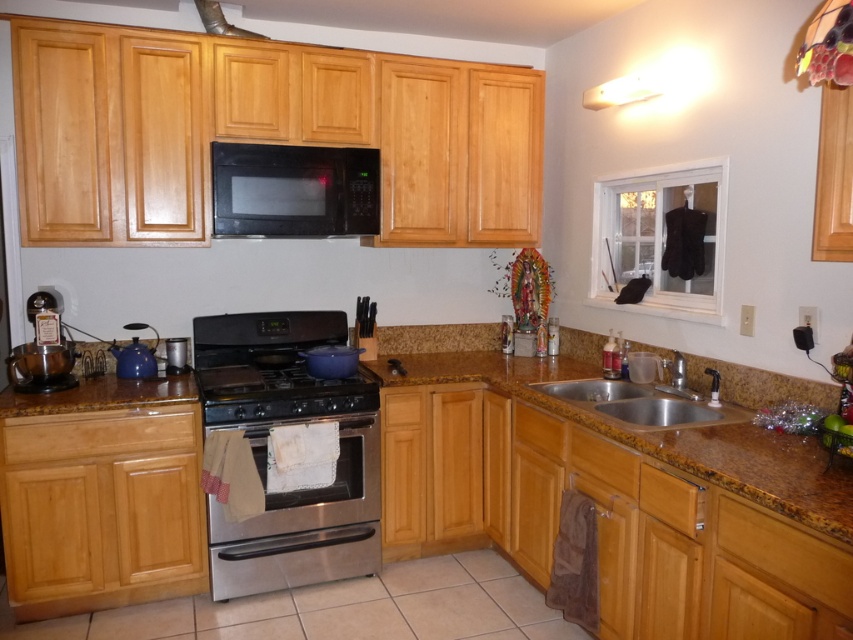
You are standing in the kitchen and need to place a new appliance. Where exactly is the stainless steel oven at center located in the kitchen?

The stainless steel oven at center is located at point coordinates of 0.823 on the x axis and 0.359 on the y axis.

You are a chef preparing to place a hot pan on the brown granite countertop at center. However, there is a metallic silver exhaust hood at upper center above it. Is the exhaust hood positioned above the countertop where you want to place the pan?

The brown granite countertop at center is in front of the metallic silver exhaust hood at upper center, meaning the exhaust hood is located behind the countertop. Therefore, it will not be directly above the area where you plan to place the pan.

You are standing in the kitchen and want to reach both points. Which point, point (619, 388) or point (221, 28), is closer to you?

Point (619, 388) is closer to you than point (221, 28).